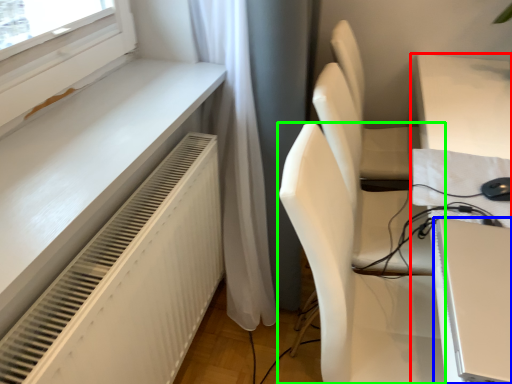
Question: Estimate the real-world distances between objects in this image. Which object is closer to table (highlighted by a red box), computer (highlighted by a blue box) or chair (highlighted by a green box)?

Choices:
 (A) computer
 (B) chair

Answer: (B)